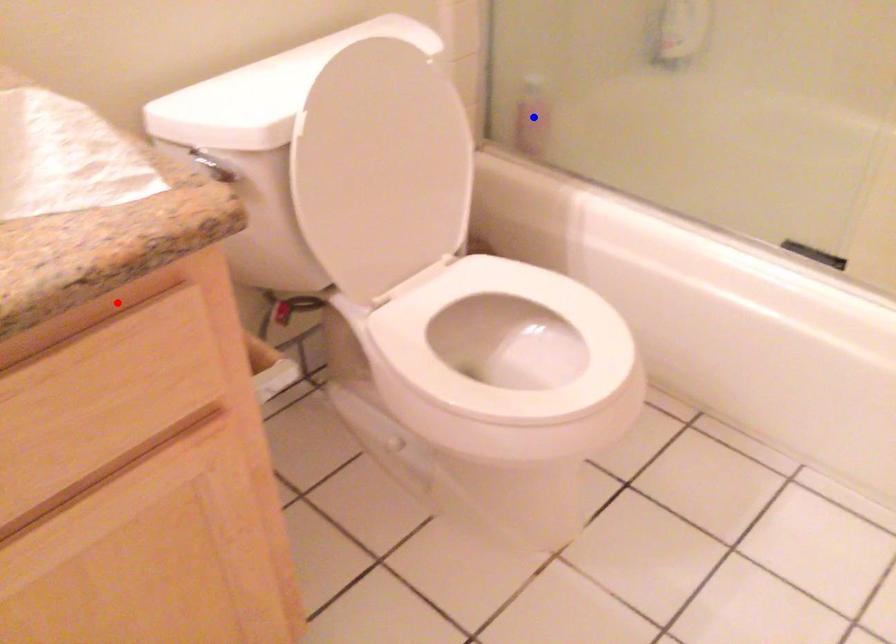
Question: In the image, two points are highlighted. Which point is nearer to the camera? Reply with the corresponding letter.

Choices:
 (A) blue point
 (B) red point

Answer: (B)